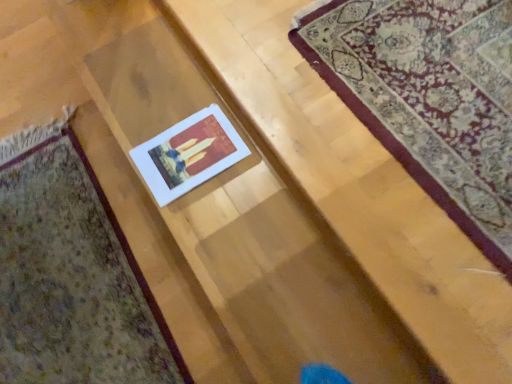
Locate an element on the screen. This screenshot has width=512, height=384. free location above white paper at center (from a real-world perspective) is located at coordinates (393, 90).